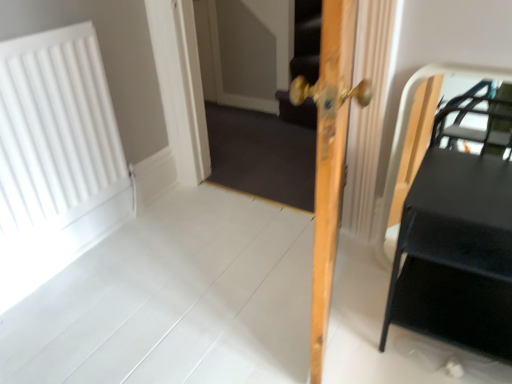
This screenshot has height=384, width=512. Identify the location of free space below light wood door at center (from a real-world perspective). (334, 307).